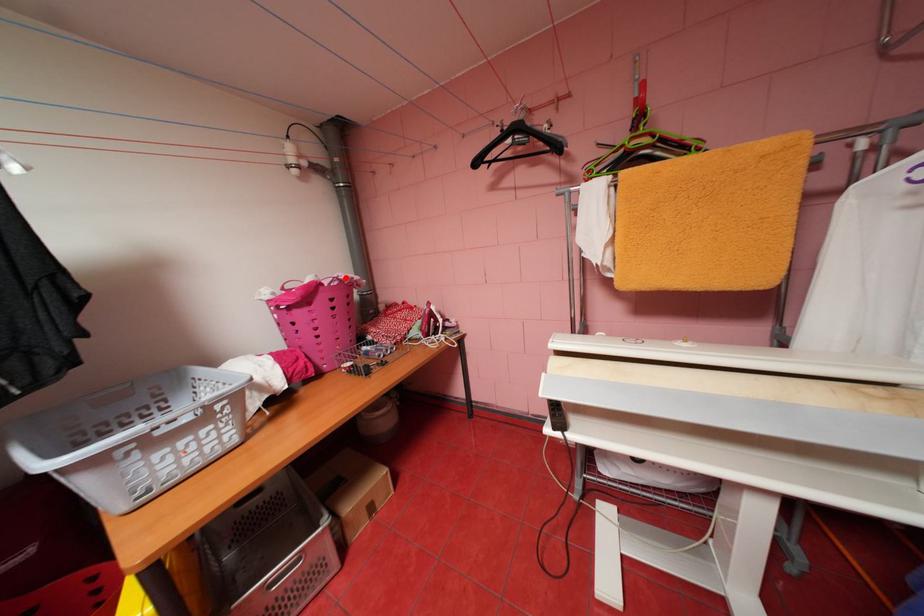
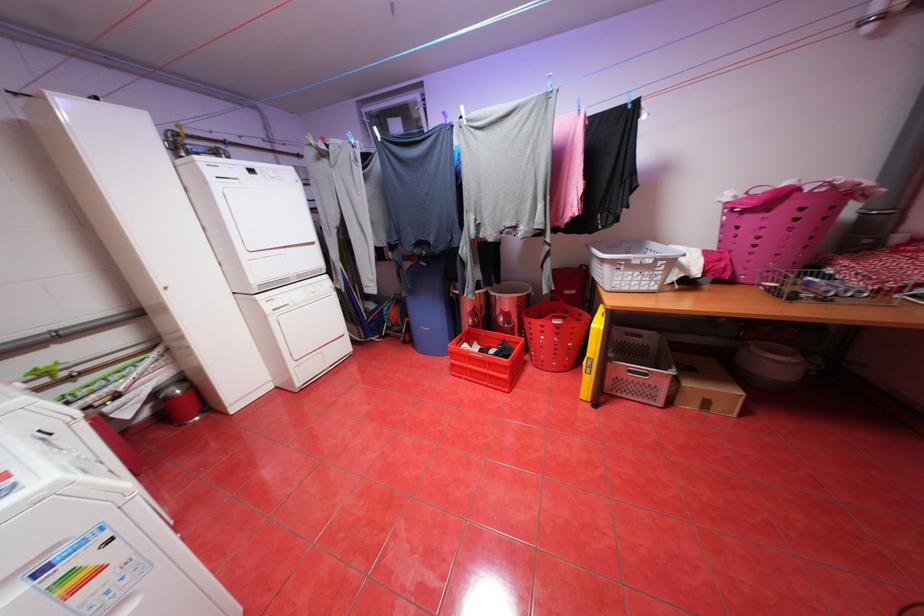
Question: I am providing you with two images of the same scene from different viewpoints. A red point is shown in image1. For the corresponding object point in image2, is it positioned nearer or farther from the camera?

Choices:
 (A) Nearer
 (B) Farther

Answer: (B)